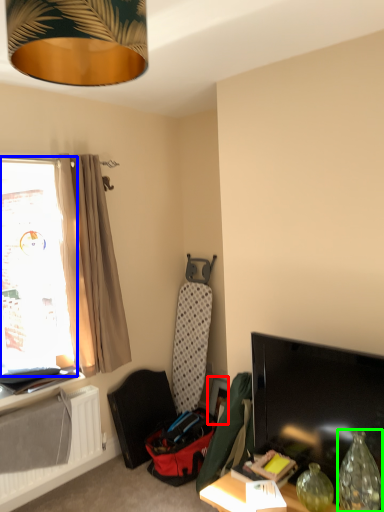
Question: Estimate the real-world distances between objects in this image. Which object is closer to picture frame (highlighted by a red box), window (highlighted by a blue box) or vase (highlighted by a green box)?

Choices:
 (A) window
 (B) vase

Answer: (B)